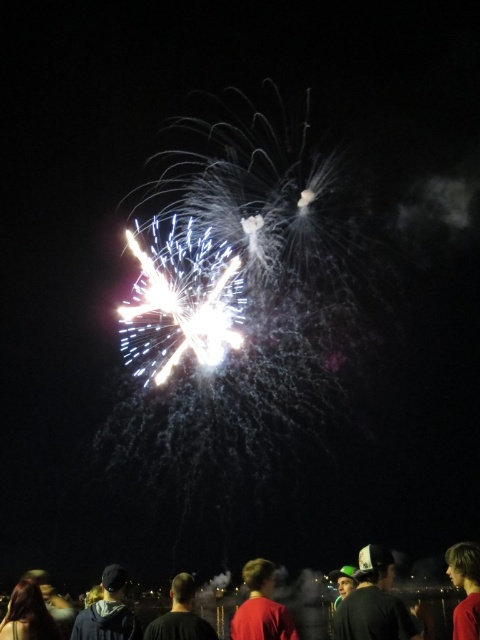
Question: Which object appears closest to the camera in this image?

Choices:
 (A) green cap at lower right
 (B) dark blue hoodie at lower left
 (C) black matte shirt at lower center
 (D) red matte shirt at center

Answer: (A)

Question: Estimate the real-world distances between objects in this image. Which object is closer to the green cap at lower right?

Choices:
 (A) blonde hair at lower right
 (B) red shirt at lower center
 (C) smooth brown hair at lower left
 (D) black matte shirt at lower center

Answer: (B)

Question: Is the position of red shirt at lower center more distant than that of black matte shirt at lower center?

Choices:
 (A) yes
 (B) no

Answer: (B)

Question: Which of these objects is positioned closest to the smooth brown hair at lower left?

Choices:
 (A) green cap at lower right
 (B) blonde hair at lower right

Answer: (A)

Question: Is green cap at lower right further to camera compared to black matte shirt at lower center?

Choices:
 (A) yes
 (B) no

Answer: (B)

Question: Is green cap at lower right thinner than smooth brown hair at lower left?

Choices:
 (A) yes
 (B) no

Answer: (B)